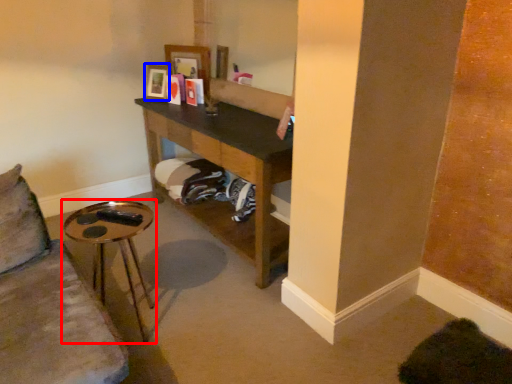
Question: Which object is further to the camera taking this photo, table (highlighted by a red box) or picture frame (highlighted by a blue box)?

Choices:
 (A) table
 (B) picture frame

Answer: (B)